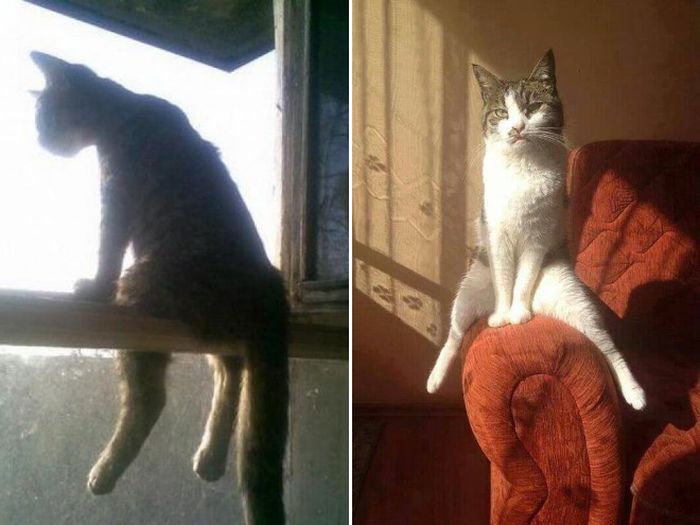
You are a GUI agent. You are given a task and a screenshot of the screen. Output one action in this format:
    pyautogui.click(x=<x>, y=<y>)
    Task: Click on the orange cushion seat
    This screenshot has width=700, height=525.
    Given the screenshot: What is the action you would take?
    pyautogui.click(x=664, y=455)